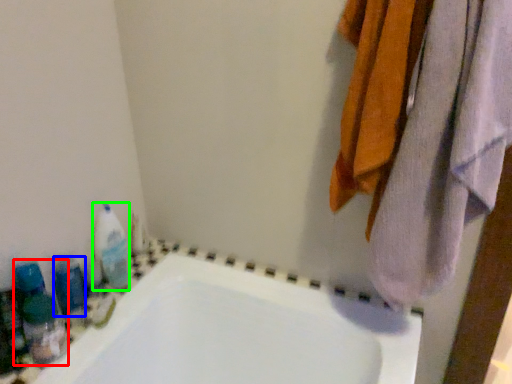
Question: Estimate the real-world distances between objects in this image. Which object is farther from cleaning product (highlighted by a red box), toiletry (highlighted by a blue box) or cleaning product (highlighted by a green box)?

Choices:
 (A) toiletry
 (B) cleaning product

Answer: (B)